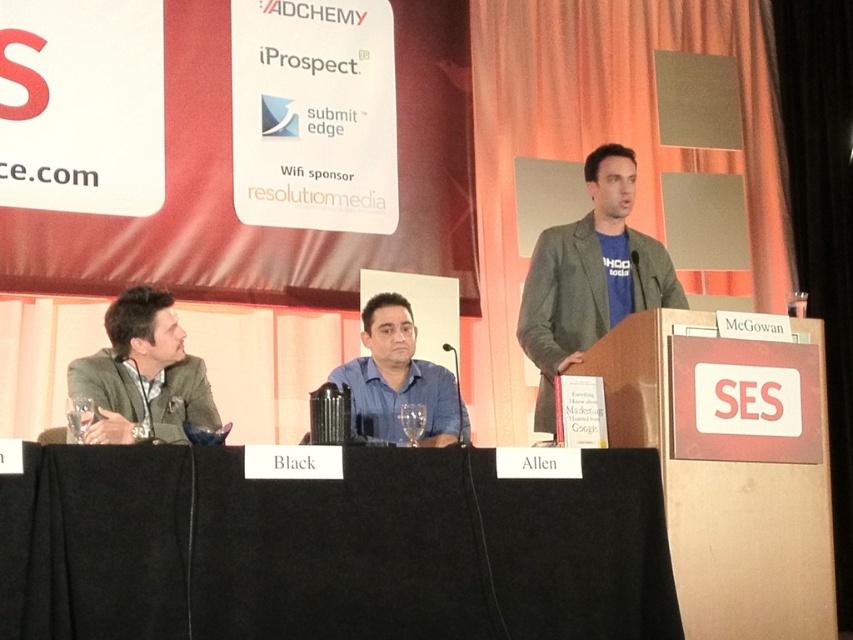
Between black fabric table at center and blue cotton t-shirt at center, which one appears on the right side from the viewer's perspective?

blue cotton t-shirt at center is more to the right.

Is black fabric table at center above blue cotton t-shirt at center?

Incorrect, black fabric table at center is not positioned above blue cotton t-shirt at center.

This screenshot has height=640, width=853. I want to click on black fabric table at center, so click(x=329, y=548).

Can you confirm if matte gray suit at left is taller than blue shirt at center?

In fact, matte gray suit at left may be shorter than blue shirt at center.

Can you confirm if matte gray suit at left is thinner than blue shirt at center?

In fact, matte gray suit at left might be wider than blue shirt at center.

Describe the element at coordinates (143, 372) in the screenshot. The width and height of the screenshot is (853, 640). I see `matte gray suit at left` at that location.

Locate an element on the screen. matte gray suit at left is located at coordinates (143, 372).

Between black fabric table at center and blue shirt at center, which one appears on the left side from the viewer's perspective?

black fabric table at center

Is point (450, 618) in front of point (386, 321)?

Yes, point (450, 618) is closer to viewer.

Locate an element on the screen. This screenshot has width=853, height=640. black fabric table at center is located at coordinates (329, 548).